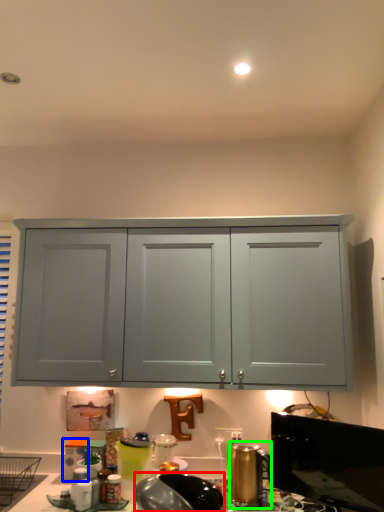
Question: Which object is the farthest from appliance (highlighted by a red box)? Choose among these: appliance (highlighted by a blue box) or appliance (highlighted by a green box).

Choices:
 (A) appliance
 (B) appliance

Answer: (A)